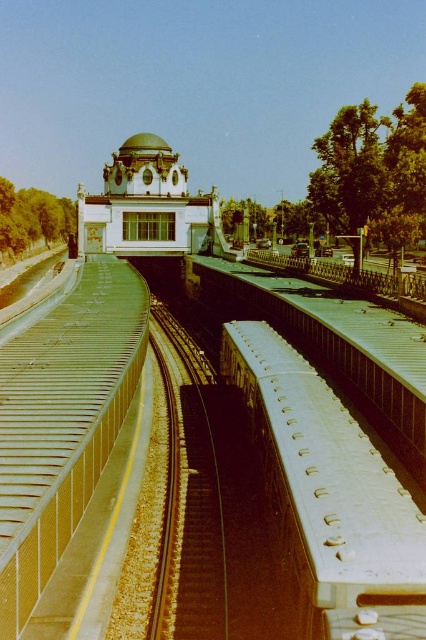
Is point (350, 544) farther from camera compared to point (154, 627)?

No, it is not.

What do you see at coordinates (330, 497) in the screenshot? I see `white matte train at center` at bounding box center [330, 497].

Find the location of a particular element. white matte train at center is located at coordinates (330, 497).